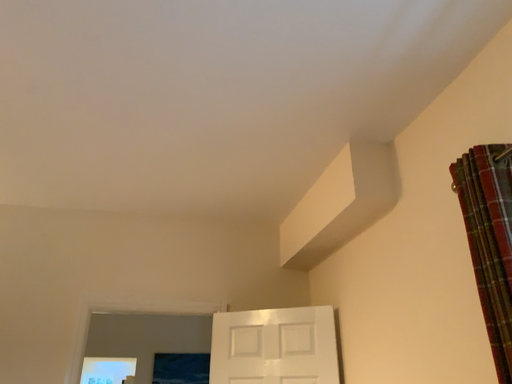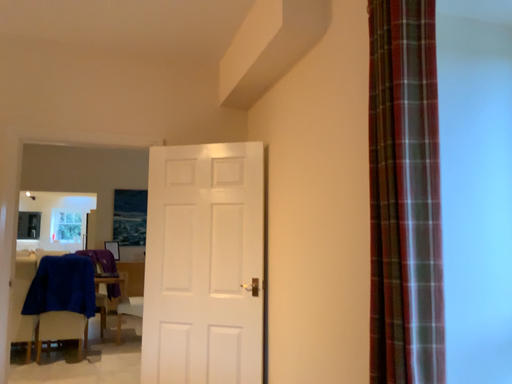
Question: Which way did the camera rotate in the video?

Choices:
 (A) rotated downward
 (B) rotated upward

Answer: (A)